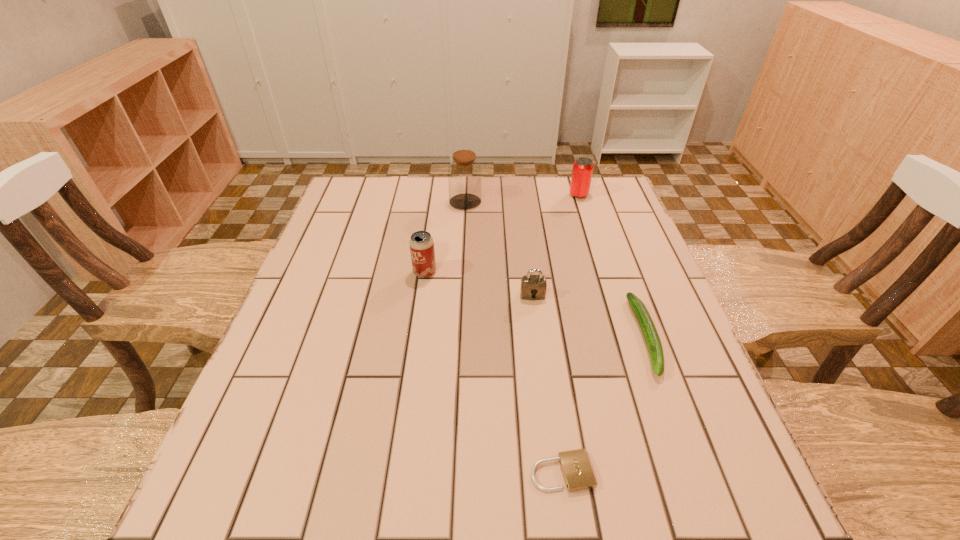
Identify the location of free space between the fifth tallest object and the taller padlock. pyautogui.click(x=589, y=316).

The height and width of the screenshot is (540, 960). In order to click on vacant area that lies between the nearest object and the can in this screenshot , I will do `click(570, 333)`.

Locate an element on the screen. The height and width of the screenshot is (540, 960). free space between the second object from right to left and the tallest object is located at coordinates (522, 198).

Where is `vacant space that is in between the can and the shorter padlock`? This screenshot has width=960, height=540. vacant space that is in between the can and the shorter padlock is located at coordinates (570, 333).

The image size is (960, 540). I want to click on empty space that is in between the second object from left to right and the beer can, so click(x=445, y=237).

In order to click on free spot between the nearest object and the fifth object from left to right in this screenshot , I will do [570, 333].

Image resolution: width=960 pixels, height=540 pixels. Find the location of `empty space that is in between the second shortest object and the second object from right to left`. empty space that is in between the second shortest object and the second object from right to left is located at coordinates (612, 266).

At what (x,y) coordinates should I click in order to perform the action: click on free area in between the second object from left to right and the can. Please return your answer as a coordinate pair (x, y). The image size is (960, 540). Looking at the image, I should click on (522, 198).

This screenshot has width=960, height=540. Identify the location of unoccupied position between the can and the tallest object. click(x=522, y=198).

You are a GUI agent. You are given a task and a screenshot of the screen. Output one action in this format:
    pyautogui.click(x=<x>, y=<y>)
    Task: Click on the object that is the nearest to the farther padlock
    This screenshot has width=960, height=540.
    Given the screenshot: What is the action you would take?
    pyautogui.click(x=646, y=324)